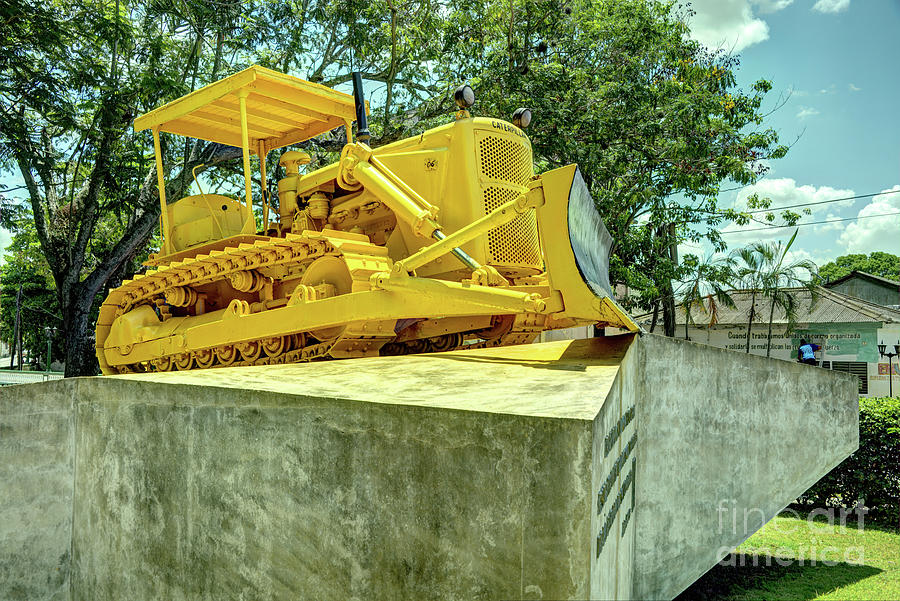
Locate an element on the screen. This screenshot has width=900, height=601. knob is located at coordinates (223, 206).